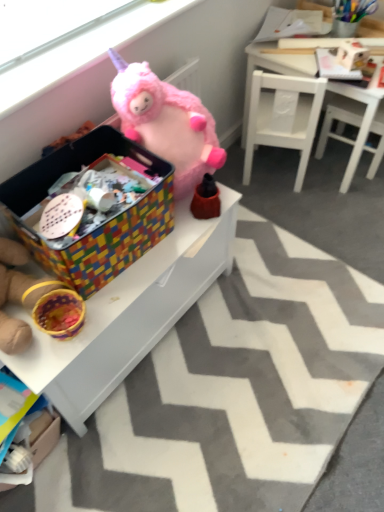
In order to click on unoccupied area in front of white matte chair at upper right in this screenshot , I will do tap(290, 206).